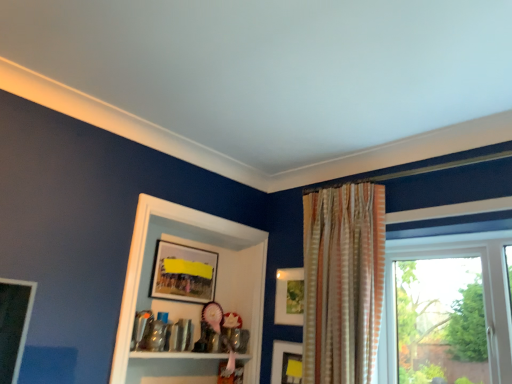
Question: Considering the relative sizes of wooden picture frame at center, placed as the 3th picture frame when sorted from right to left, and matte wooden picture frame at upper center, which is the 4th picture frame from right to left, in the image provided, is wooden picture frame at center, placed as the 3th picture frame when sorted from right to left, smaller than matte wooden picture frame at upper center, which is the 4th picture frame from right to left,?

Choices:
 (A) yes
 (B) no

Answer: (A)

Question: Is wooden picture frame at center, placed as the 2th picture frame when sorted from left to right, in front of matte wooden picture frame at upper center, which is the first picture frame in left-to-right order?

Choices:
 (A) yes
 (B) no

Answer: (A)

Question: From the image's perspective, is wooden picture frame at center, placed as the 3th picture frame when sorted from right to left, over matte wooden picture frame at upper center, which is the first picture frame in left-to-right order?

Choices:
 (A) no
 (B) yes

Answer: (A)

Question: From the image's perspective, would you say wooden picture frame at center, placed as the 3th picture frame when sorted from right to left, is shown under matte wooden picture frame at upper center, which is the 4th picture frame from right to left?

Choices:
 (A) yes
 (B) no

Answer: (A)

Question: Can you confirm if wooden picture frame at center, placed as the 3th picture frame when sorted from right to left, is thinner than matte wooden picture frame at upper center, which is the first picture frame in left-to-right order?

Choices:
 (A) yes
 (B) no

Answer: (A)

Question: From a real-world perspective, is wooden picture frame at center, placed as the 3th picture frame when sorted from right to left, physically located above or below matte white picture frame at center, placed as the second picture frame when sorted from right to left?

Choices:
 (A) below
 (B) above

Answer: (A)

Question: Considering their positions, is wooden picture frame at center, placed as the 2th picture frame when sorted from left to right, located in front of or behind matte white picture frame at center, the third picture frame from the left?

Choices:
 (A) front
 (B) behind

Answer: (A)

Question: From the image's perspective, is wooden picture frame at center, placed as the 3th picture frame when sorted from right to left, located above or below matte white picture frame at center, placed as the second picture frame when sorted from right to left?

Choices:
 (A) above
 (B) below

Answer: (B)

Question: Considering the positions of wooden picture frame at center, placed as the 2th picture frame when sorted from left to right, and matte white picture frame at center, placed as the second picture frame when sorted from right to left, in the image, is wooden picture frame at center, placed as the 2th picture frame when sorted from left to right, wider or thinner than matte white picture frame at center, placed as the second picture frame when sorted from right to left,?

Choices:
 (A) thin
 (B) wide

Answer: (A)

Question: Considering their positions, is striped fabric curtain at upper right located in front of or behind wooden picture frame at center, placed as the 2th picture frame when sorted from left to right?

Choices:
 (A) front
 (B) behind

Answer: (A)

Question: From a real-world perspective, is striped fabric curtain at upper right above or below wooden picture frame at center, placed as the 3th picture frame when sorted from right to left?

Choices:
 (A) above
 (B) below

Answer: (A)

Question: In terms of size, does striped fabric curtain at upper right appear bigger or smaller than wooden picture frame at center, placed as the 2th picture frame when sorted from left to right?

Choices:
 (A) small
 (B) big

Answer: (B)

Question: Looking at their shapes, would you say striped fabric curtain at upper right is wider or thinner than wooden picture frame at center, placed as the 3th picture frame when sorted from right to left?

Choices:
 (A) wide
 (B) thin

Answer: (A)

Question: Is matte yellow picture frame at lower right, marked as the first picture frame in a right-to-left arrangement, to the left or to the right of matte wooden picture frame at upper center, which is the first picture frame in left-to-right order, in the image?

Choices:
 (A) left
 (B) right

Answer: (B)

Question: Considering the positions of matte yellow picture frame at lower right, marked as the first picture frame in a right-to-left arrangement, and matte wooden picture frame at upper center, which is the 4th picture frame from right to left, in the image, is matte yellow picture frame at lower right, marked as the first picture frame in a right-to-left arrangement, taller or shorter than matte wooden picture frame at upper center, which is the 4th picture frame from right to left,?

Choices:
 (A) tall
 (B) short

Answer: (B)